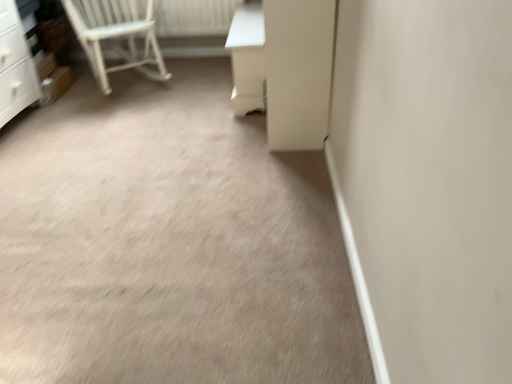
Question: Can you confirm if white wooden chair at upper left is bigger than white painted wood radiator at upper left?

Choices:
 (A) no
 (B) yes

Answer: (B)

Question: Would you consider white wooden chair at upper left to be distant from white painted wood radiator at upper left?

Choices:
 (A) no
 (B) yes

Answer: (A)

Question: Is the position of white wooden chair at upper left more distant than that of white painted wood radiator at upper left?

Choices:
 (A) yes
 (B) no

Answer: (B)

Question: Is the surface of white wooden chair at upper left in direct contact with white painted wood radiator at upper left?

Choices:
 (A) no
 (B) yes

Answer: (A)

Question: Can you confirm if white wooden chair at upper left is positioned to the right of white painted wood radiator at upper left?

Choices:
 (A) no
 (B) yes

Answer: (A)

Question: Which is correct: beige carpet at center is inside white glossy screen door at center, or outside of it?

Choices:
 (A) inside
 (B) outside

Answer: (B)

Question: Considering the positions of beige carpet at center and white glossy screen door at center in the image, is beige carpet at center taller or shorter than white glossy screen door at center?

Choices:
 (A) tall
 (B) short

Answer: (B)

Question: Relative to white glossy screen door at center, is beige carpet at center in front or behind?

Choices:
 (A) behind
 (B) front

Answer: (B)

Question: From the image's perspective, is beige carpet at center positioned above or below white glossy screen door at center?

Choices:
 (A) above
 (B) below

Answer: (B)

Question: In terms of size, does white wooden chair at upper left appear bigger or smaller than beige carpet at center?

Choices:
 (A) big
 (B) small

Answer: (A)

Question: Is white wooden chair at upper left taller or shorter than beige carpet at center?

Choices:
 (A) short
 (B) tall

Answer: (B)

Question: Is white wooden chair at upper left wider or thinner than beige carpet at center?

Choices:
 (A) thin
 (B) wide

Answer: (A)

Question: From the image's perspective, is white wooden chair at upper left above or below beige carpet at center?

Choices:
 (A) above
 (B) below

Answer: (A)

Question: Is white glossy vanity at upper right bigger or smaller than white glossy screen door at center?

Choices:
 (A) big
 (B) small

Answer: (B)

Question: Is white glossy vanity at upper right taller or shorter than white glossy screen door at center?

Choices:
 (A) tall
 (B) short

Answer: (B)